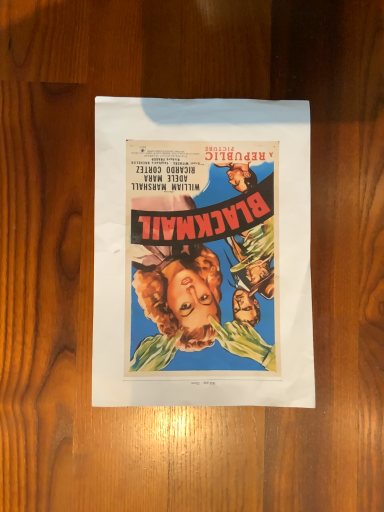
Find the location of a particular element. This screenshot has width=384, height=512. free spot above vibrant paper poster at center (from a real-world perspective) is located at coordinates (201, 253).